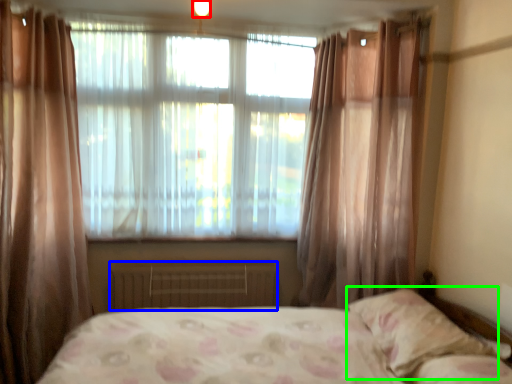
Question: Based on their relative distances, which object is farther from light (highlighted by a red box)? Choose from radiator (highlighted by a blue box) and pillow (highlighted by a green box).

Choices:
 (A) radiator
 (B) pillow

Answer: (B)